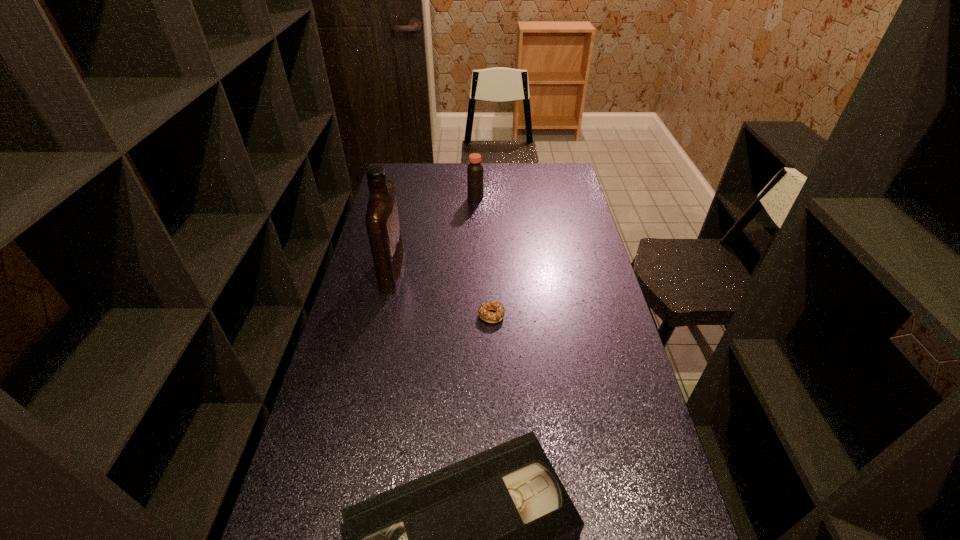
Locate an element on the screen. Image resolution: width=960 pixels, height=540 pixels. free point that satisfies the following two spatial constraints: 1. on the label side of the third nearest object; 2. on the right side of the doughnut is located at coordinates (382, 315).

Where is `blank area in the image that satisfies the following two spatial constraints: 1. on the label side of the shortest object; 2. on the right side of the liquor`? The height and width of the screenshot is (540, 960). blank area in the image that satisfies the following two spatial constraints: 1. on the label side of the shortest object; 2. on the right side of the liquor is located at coordinates (382, 315).

Locate an element on the screen. The image size is (960, 540). vacant space that satisfies the following two spatial constraints: 1. on the back side of the shortest object; 2. on the label side of the liquor is located at coordinates (490, 269).

You are a GUI agent. You are given a task and a screenshot of the screen. Output one action in this format:
    pyautogui.click(x=<x>, y=<y>)
    Task: Click on the free space that satisfies the following two spatial constraints: 1. on the label side of the shortest object; 2. on the left side of the third nearest object
    The width and height of the screenshot is (960, 540).
    Given the screenshot: What is the action you would take?
    pyautogui.click(x=382, y=315)

In order to click on vacant space that satisfies the following two spatial constraints: 1. on the label side of the shortest object; 2. on the left side of the second farthest object in this screenshot , I will do `click(382, 315)`.

The image size is (960, 540). What are the coordinates of `free region that satisfies the following two spatial constraints: 1. on the label side of the tallest object; 2. on the back side of the shortest object` in the screenshot? It's located at (382, 315).